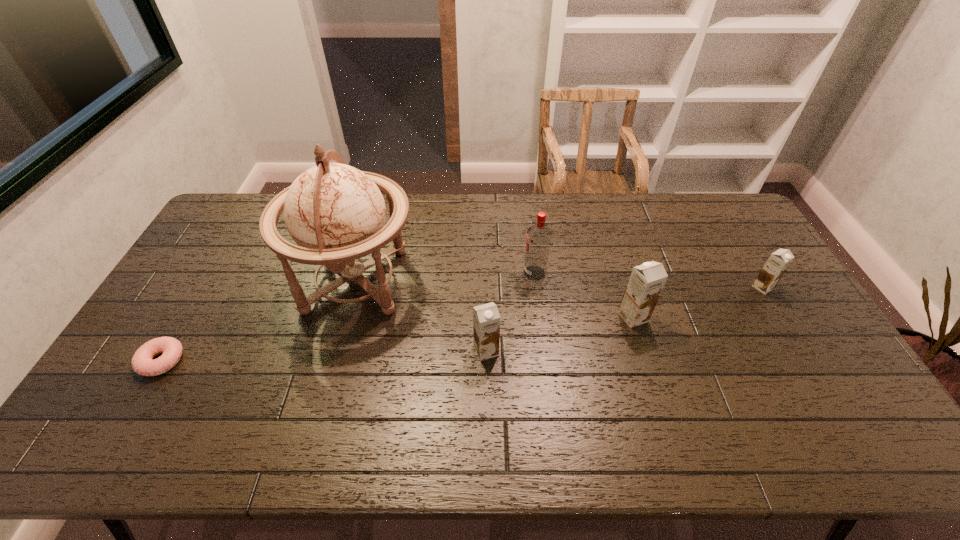
The image size is (960, 540). I want to click on the nearest chocolate milk, so click(x=486, y=319).

I want to click on the third object from left to right, so click(x=486, y=319).

Locate an element on the screen. The image size is (960, 540). the second nearest chocolate milk is located at coordinates pyautogui.click(x=646, y=282).

Find the location of a particular element. the fifth object from left to right is located at coordinates (646, 282).

This screenshot has width=960, height=540. What are the coordinates of `the fifth tallest object` in the screenshot? It's located at (778, 262).

I want to click on the rightmost object, so click(x=778, y=262).

This screenshot has height=540, width=960. Identify the location of doughnut. (142, 363).

Identify the location of the shortest object. (142, 363).

At what (x,y) coordinates should I click in order to perform the action: click on the fourth object from left to right. Please return your answer as a coordinate pair (x, y). The height and width of the screenshot is (540, 960). Looking at the image, I should click on (539, 236).

Where is `globe`? The width and height of the screenshot is (960, 540). globe is located at coordinates (336, 213).